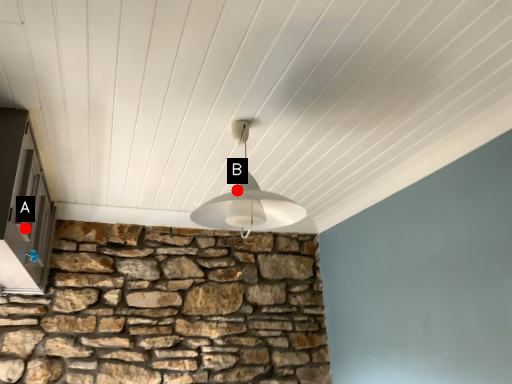
Question: Two points are circled on the image, labeled by A and B beside each circle. Which point appears closest to the camera in this image?

Choices:
 (A) A is closer
 (B) B is closer

Answer: (B)